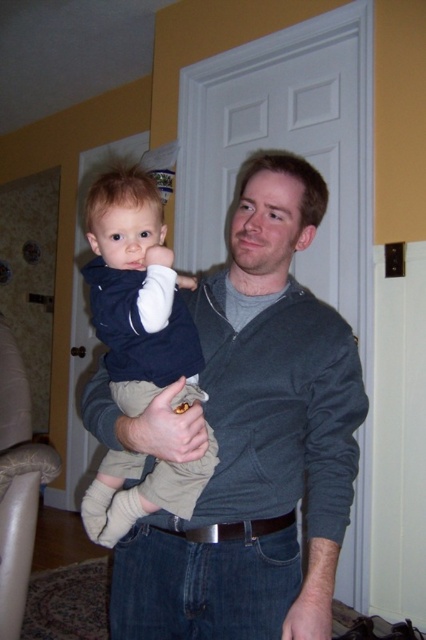
Can you confirm if dark gray sweater at center is thinner than dark gray corduroy sleeve at center?

No, dark gray sweater at center is not thinner than dark gray corduroy sleeve at center.

Does dark gray sweater at center have a larger size compared to dark gray corduroy sleeve at center?

Yes, dark gray sweater at center is bigger than dark gray corduroy sleeve at center.

Does point (236, 472) come in front of point (294, 628)?

No, it is behind (294, 628).

Identify the location of dark gray sweater at center. Image resolution: width=426 pixels, height=640 pixels. (247, 438).

Is point (134, 188) closer to viewer compared to point (319, 486)?

No, it is not.

This screenshot has width=426, height=640. I want to click on matte blue shirt at center, so click(x=138, y=292).

This screenshot has height=640, width=426. In order to click on matte blue shirt at center in this screenshot , I will do `click(138, 292)`.

Does dark gray sweater at center have a greater width compared to matte blue shirt at center?

Indeed, dark gray sweater at center has a greater width compared to matte blue shirt at center.

Is point (319, 474) positioned behind point (132, 387)?

That is False.

Does point (230, 371) lie behind point (121, 246)?

That is False.

Identify the location of dark gray sweater at center. (247, 438).